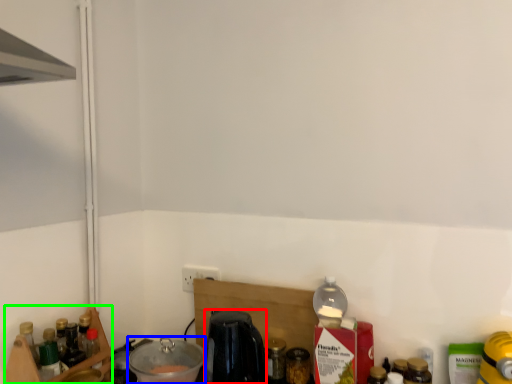
Question: Considering the real-world distances, which object is closest to coffee machine (highlighted by a red box)? appliance (highlighted by a blue box) or shelf (highlighted by a green box).

Choices:
 (A) appliance
 (B) shelf

Answer: (A)